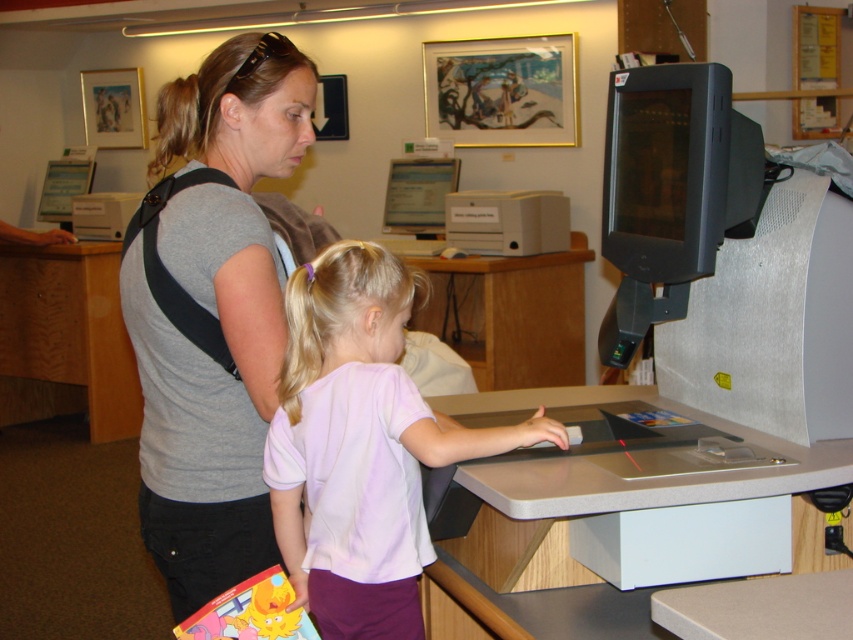
You are a photographer standing in front of the computer terminal. You want to take a photo of the light purple cotton shirt at center and the matte plastic monitor at center. Which object will appear larger in the photo?

The light purple cotton shirt at center will appear larger in the photo because it is closer to the viewer than the matte plastic monitor at center.

You are a photographer trying to capture a clear photo of the matte plastic monitor at center without the light purple cotton shirt at center blocking it. Based on their sizes, which object should you focus on to ensure the monitor is visible?

The light purple cotton shirt at center has a larger size compared to matte plastic monitor at center, so focusing on the matte plastic monitor at center might result in it being blocked by the larger shirt. To ensure visibility, you should adjust your angle or position to avoid the larger light purple cotton shirt at center obstructing the smaller matte plastic monitor at center.

You are a photographer trying to capture a clear photo of the matte black monitor at upper center without the gray matte shirt at center blocking it. Based on their positions, which side should you move to in order to frame the monitor properly?

Since the gray matte shirt at center is to the right of the matte black monitor at upper center, you should move to the left side to frame the monitor properly, avoiding the obstruction from the shirt.